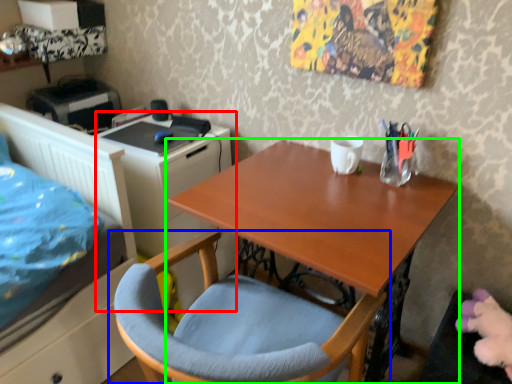
Question: Based on their relative distances, which object is nearer to file cabinet (highlighted by a red box)? Choose from chair (highlighted by a blue box) and desk (highlighted by a green box).

Choices:
 (A) chair
 (B) desk

Answer: (A)